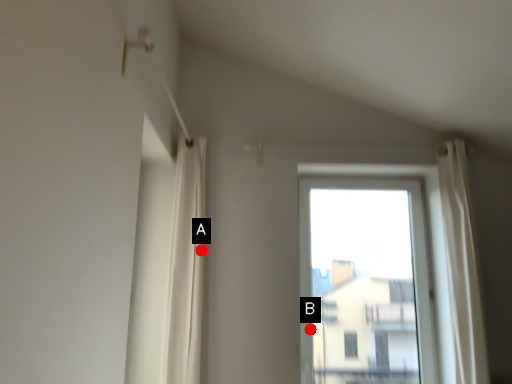
Question: Two points are circled on the image, labeled by A and B beside each circle. Which point appears closest to the camera in this image?

Choices:
 (A) A is closer
 (B) B is closer

Answer: (A)